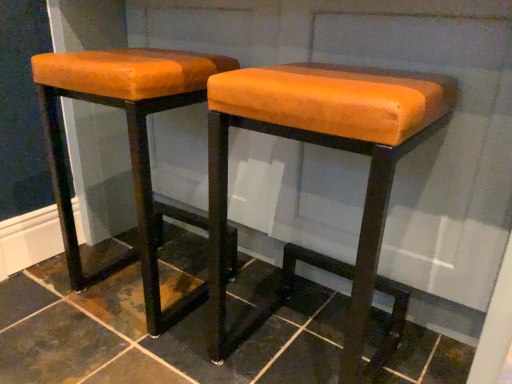
This screenshot has width=512, height=384. Identify the location of vacant area on top of dark brown tile at center (from a real-world perspective). (202, 307).